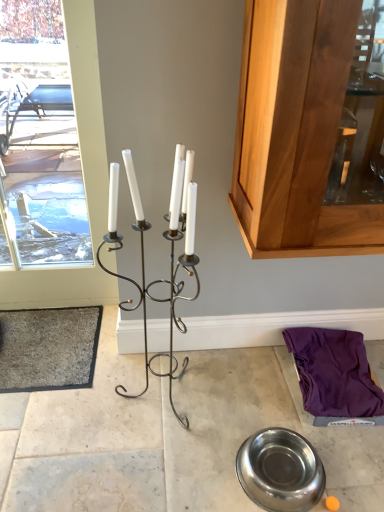
Identify the location of unoccupied region to the right of polished stainless steel bowl at lower center. (345, 466).